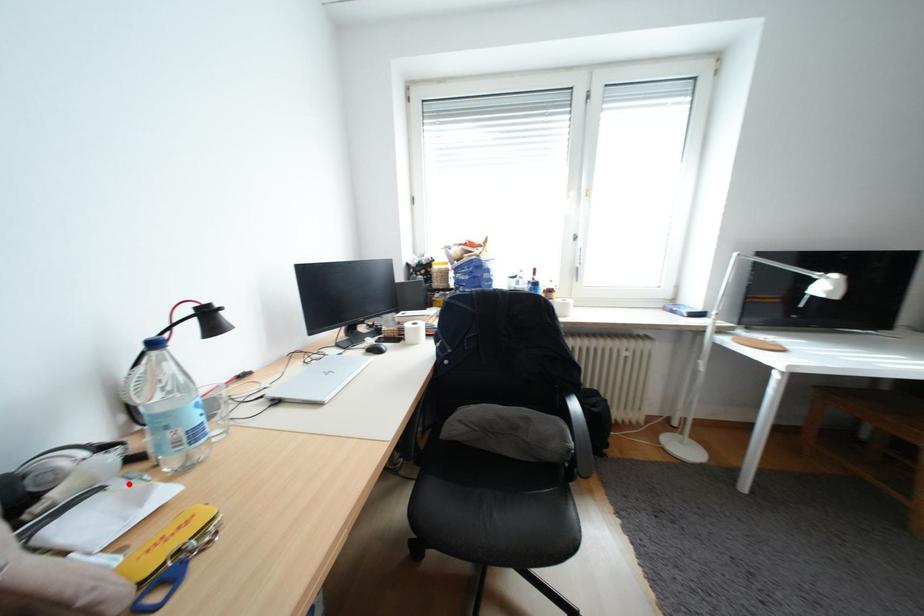
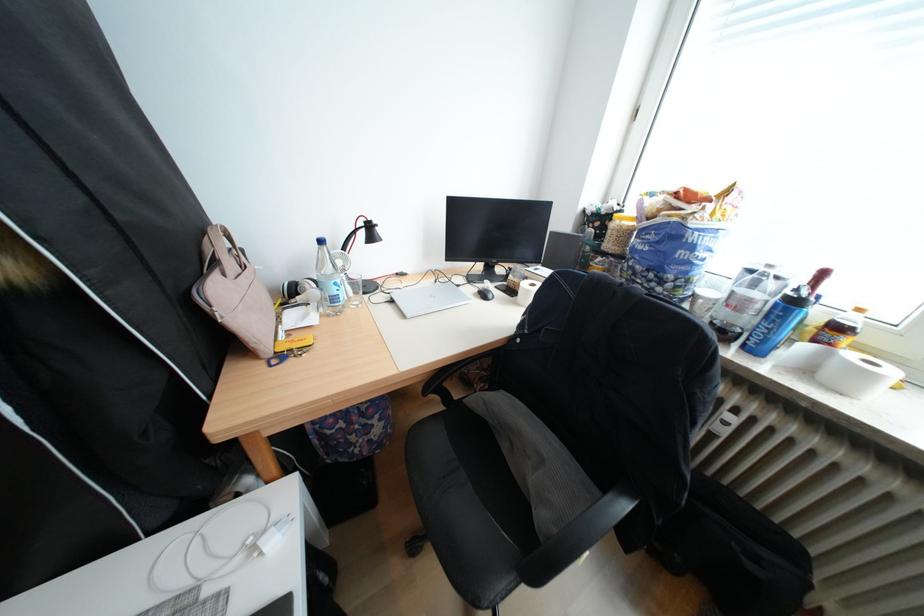
Locate, in the second image, the point that corresponds to the highlighted location in the first image.

(325, 306)